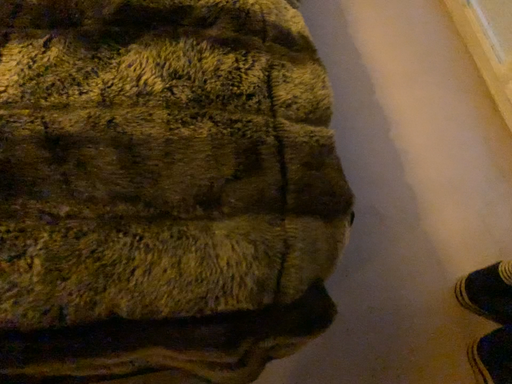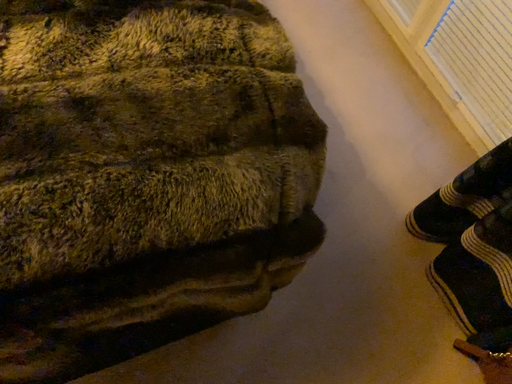
Question: How did the camera likely rotate when shooting the video?

Choices:
 (A) rotated left
 (B) rotated right

Answer: (B)